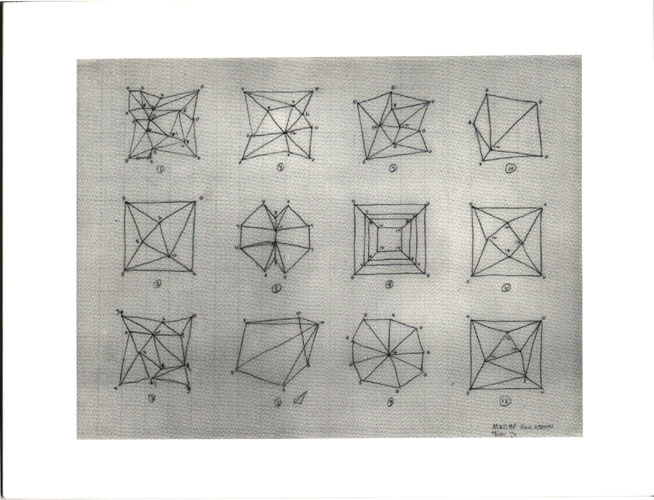
In order to click on 1 cloth surface in this screenshot , I will do `click(104, 182)`.